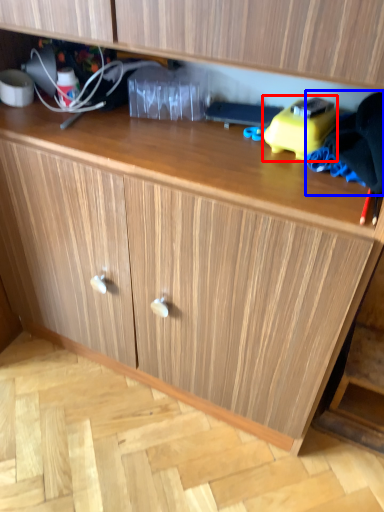
Question: Which point is further to the camera, toy (highlighted by a red box) or clothing (highlighted by a blue box)?

Choices:
 (A) toy
 (B) clothing

Answer: (A)